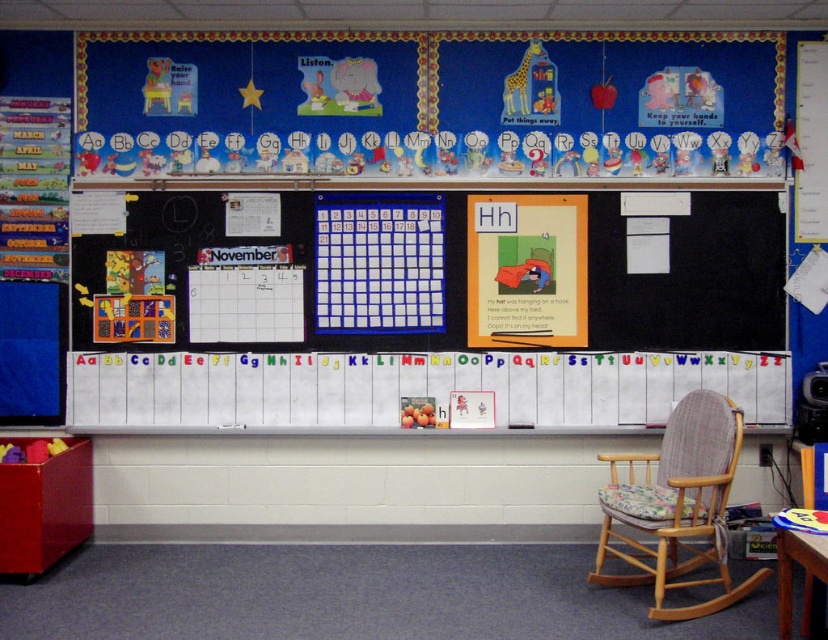
Question: Does matte black calendar at center have a smaller size compared to wooden upholstered rocking chair at lower right?

Choices:
 (A) no
 (B) yes

Answer: (B)

Question: Which object is farther from the camera taking this photo?

Choices:
 (A) wooden upholstered rocking chair at lower right
 (B) wooden table at lower right

Answer: (A)

Question: Can you confirm if matte black calendar at center is thinner than wooden upholstered rocking chair at lower right?

Choices:
 (A) yes
 (B) no

Answer: (B)

Question: Which object appears closest to the camera in this image?

Choices:
 (A) wooden upholstered rocking chair at lower right
 (B) matte black calendar at center
 (C) wooden table at lower right

Answer: (C)

Question: Is matte black calendar at center below wooden upholstered rocking chair at lower right?

Choices:
 (A) no
 (B) yes

Answer: (A)

Question: Among these points, which one is farthest from the camera?

Choices:
 (A) (191, 252)
 (B) (782, 602)

Answer: (A)